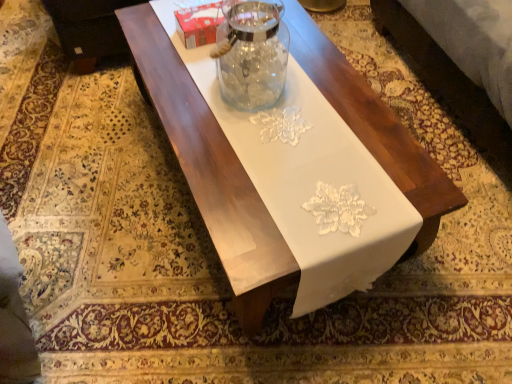
At what (x,y) coordinates should I click in order to perform the action: click on vacant space situated above white glossy table at center (from a real-world perspective). Please return your answer as a coordinate pair (x, y). Image resolution: width=512 pixels, height=384 pixels. Looking at the image, I should click on (290, 124).